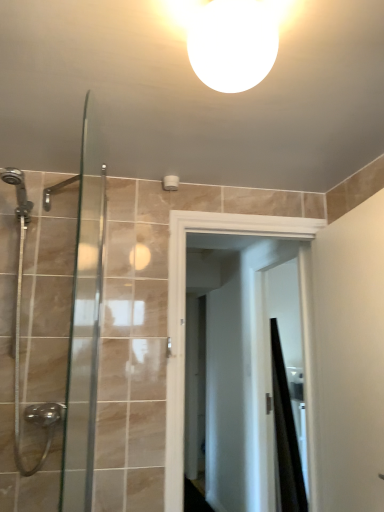
Question: Considering the positions of white glossy light fixture at upper center and black matte shower curtain at right in the image, is white glossy light fixture at upper center taller or shorter than black matte shower curtain at right?

Choices:
 (A) short
 (B) tall

Answer: (A)

Question: In the image, is white glossy light fixture at upper center on the left side or the right side of black matte shower curtain at right?

Choices:
 (A) left
 (B) right

Answer: (A)

Question: Which is nearer to the white glossy light fixture at upper center?

Choices:
 (A) matte white screen door at center
 (B) white glossy sink at upper center
 (C) black matte shower curtain at right
 (D) clear glass shower door at left

Answer: (A)

Question: Which object is the farthest from the clear glass shower door at left?

Choices:
 (A) black matte shower curtain at right
 (B) white glossy light fixture at upper center
 (C) matte white screen door at center
 (D) white glossy sink at upper center

Answer: (D)